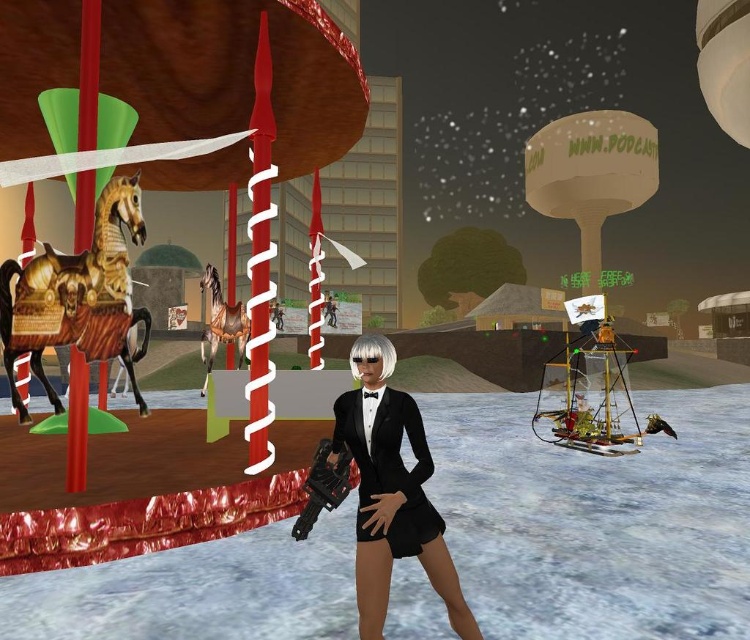
You are a character in a video game who needs to reach the golden polished wood horse at left without moving closer than 2 meters from the black satin business suit at center. Is this possible?

The distance between the black satin business suit at center and the golden polished wood horse at left is 2.17 meters, so yes, you can reach the golden polished wood horse at left while staying at least 2 meters away from the black satin business suit at center.

You are a character in the scene and need to reach the golden polished wood horse at left. If your maximum reach is 10 feet, can you touch it without moving closer?

The golden polished wood horse at left is 10.86 feet away from the camera, so you cannot touch it with a maximum reach of 10 feet without moving closer.

You are a fashion designer observing the festive scene. You need to determine the relative height of the black satin business suit at center and the golden polished wood horse at left. Which one is taller?

The golden polished wood horse at left is taller than the black satin business suit at center.